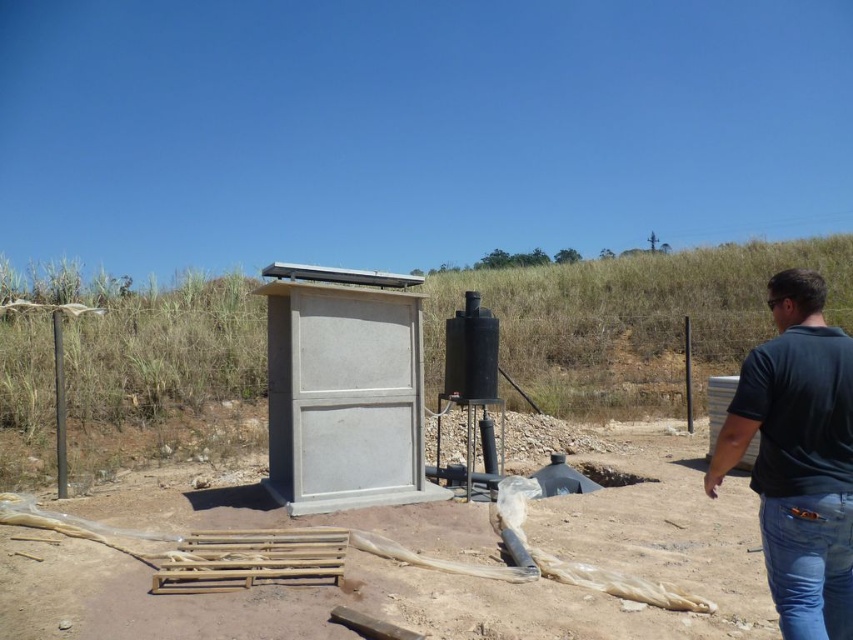
Question: Does gray concrete cabinet at center have a lesser width compared to dark blue shirt at right?

Choices:
 (A) yes
 (B) no

Answer: (B)

Question: Can you confirm if dark blue shirt at right is positioned above blue denim jeans at lower right?

Choices:
 (A) no
 (B) yes

Answer: (B)

Question: Which point is farther to the camera?

Choices:
 (A) (776, 588)
 (B) (283, 324)
 (C) (236, 628)

Answer: (B)

Question: Which object appears farthest from the camera in this image?

Choices:
 (A) dirt at center
 (B) dark blue shirt at right

Answer: (A)

Question: Can you confirm if dirt at center is thinner than gray concrete cabinet at center?

Choices:
 (A) no
 (B) yes

Answer: (B)

Question: Which of these objects is positioned closest to the dark blue shirt at right?

Choices:
 (A) dirt at center
 (B) gray concrete cabinet at center
 (C) blue denim jeans at lower right

Answer: (C)